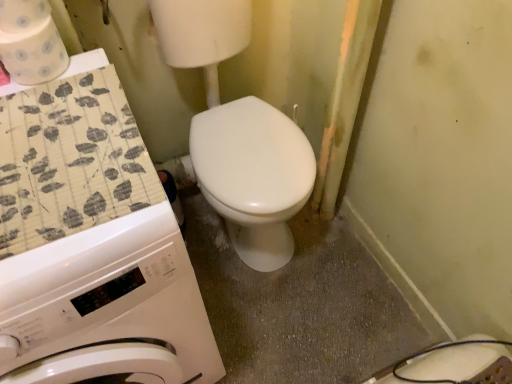
Question: In the image, is white paper towel at upper left, the 2th toilet paper in the bottom-to-top sequence, on the left side or the right side of patterned paper towel at upper left, which is the second toilet paper in top-to-bottom order?

Choices:
 (A) left
 (B) right

Answer: (A)

Question: From a real-world perspective, relative to patterned paper towel at upper left, which is the second toilet paper in top-to-bottom order, is white paper towel at upper left, placed as the 1th toilet paper when sorted from top to bottom, vertically above or below?

Choices:
 (A) below
 (B) above

Answer: (B)

Question: Estimate the real-world distances between objects in this image. Which object is farther from the white paper towel at upper left, placed as the 1th toilet paper when sorted from top to bottom?

Choices:
 (A) white glossy washing machine at left
 (B) patterned paper towel at upper left, which is the second toilet paper in top-to-bottom order

Answer: (A)

Question: Estimate the real-world distances between objects in this image. Which object is farther from the white glossy washing machine at left?

Choices:
 (A) patterned paper towel at upper left, which is the second toilet paper in top-to-bottom order
 (B) white paper towel at upper left, the 2th toilet paper in the bottom-to-top sequence

Answer: (B)